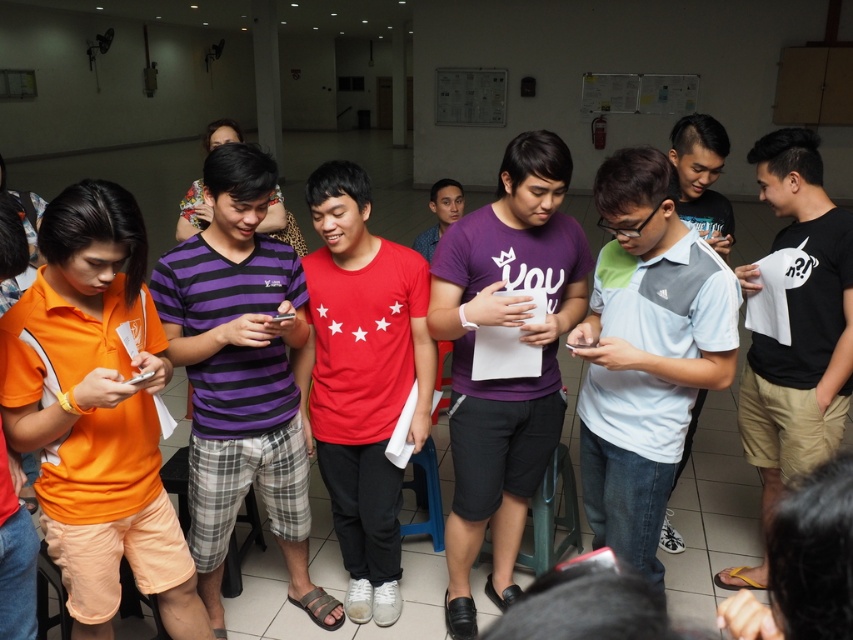
Who is lower down, purple striped shirt at center or purple matte shirt at center?

purple striped shirt at center is lower down.

Locate an element on the screen. purple striped shirt at center is located at coordinates (241, 376).

The width and height of the screenshot is (853, 640). Identify the location of purple striped shirt at center. (241, 376).

Image resolution: width=853 pixels, height=640 pixels. I want to click on purple striped shirt at center, so click(x=241, y=376).

This screenshot has height=640, width=853. Describe the element at coordinates (503, 378) in the screenshot. I see `purple matte shirt at center` at that location.

Does purple matte shirt at center have a lesser width compared to red matte t-shirt at center?

In fact, purple matte shirt at center might be wider than red matte t-shirt at center.

Which is behind, point (451, 307) or point (349, 312)?

Positioned behind is point (349, 312).

Identify the location of purple matte shirt at center. The height and width of the screenshot is (640, 853). (503, 378).

Is point (653, 262) in front of point (384, 413)?

Yes.

Based on the photo, does light blue and gray adidas polo shirt at center appear over red matte t-shirt at center?

Indeed, light blue and gray adidas polo shirt at center is positioned over red matte t-shirt at center.

This screenshot has width=853, height=640. Find the location of `light blue and gray adidas polo shirt at center`. light blue and gray adidas polo shirt at center is located at coordinates pos(645,353).